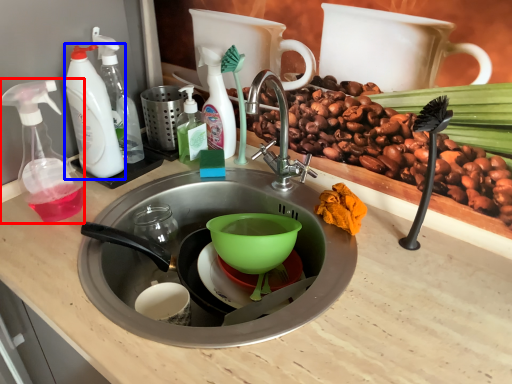
Question: Among these objects, which one is farthest to the camera, soap dispenser (highlighted by a red box) or cleaning product (highlighted by a blue box)?

Choices:
 (A) soap dispenser
 (B) cleaning product

Answer: (B)